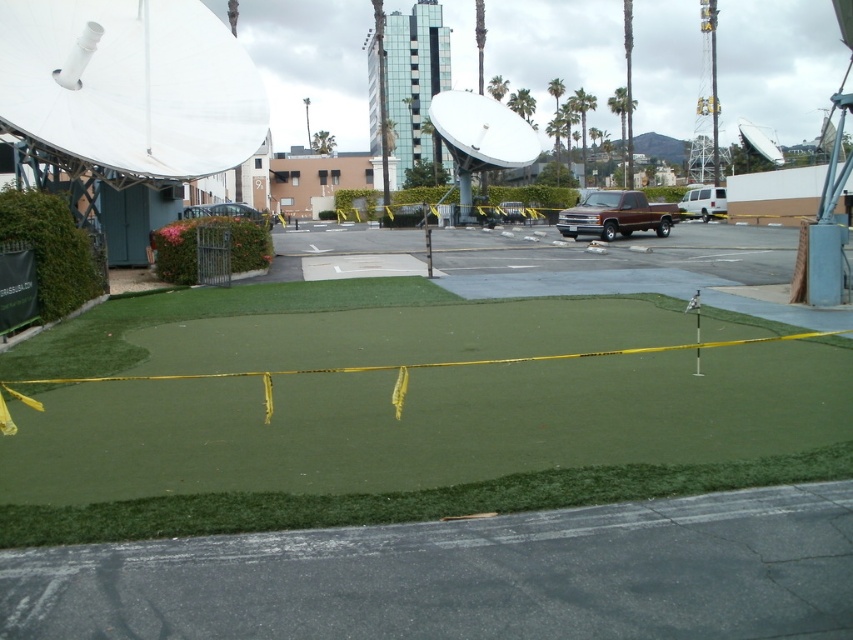
Is green artificial turf at center bigger than white van at center?

Yes.

Who is lower down, green artificial turf at center or white van at center?

green artificial turf at center

Describe the element at coordinates (418, 444) in the screenshot. This screenshot has height=640, width=853. I see `green artificial turf at center` at that location.

The width and height of the screenshot is (853, 640). In order to click on green artificial turf at center in this screenshot , I will do `click(418, 444)`.

Which is below, white van at center or metallic silver car at center?

metallic silver car at center is lower down.

Who is more forward, [683,204] or [241,218]?

Positioned in front is point [241,218].

The width and height of the screenshot is (853, 640). I want to click on white van at center, so click(x=703, y=202).

Is white metallic satellite at center taller than metallic silver car at center?

Yes, white metallic satellite at center is taller than metallic silver car at center.

Does white metallic satellite at center have a smaller size compared to metallic silver car at center?

Indeed, white metallic satellite at center has a smaller size compared to metallic silver car at center.

This screenshot has height=640, width=853. What do you see at coordinates (480, 138) in the screenshot?
I see `white metallic satellite at center` at bounding box center [480, 138].

The height and width of the screenshot is (640, 853). I want to click on white metallic satellite at center, so click(x=480, y=138).